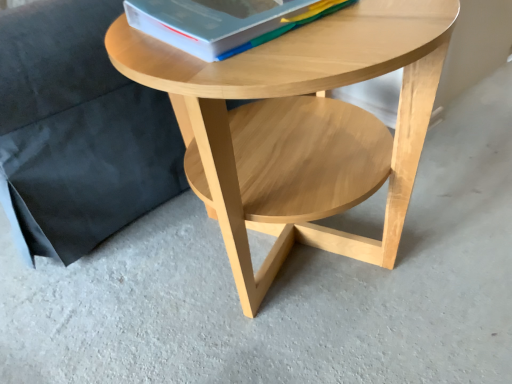
You are a GUI agent. You are given a task and a screenshot of the screen. Output one action in this format:
    pyautogui.click(x=<x>, y=<y>)
    Task: Click on the unoccupied area in front of hardcover book at upper center
    
    Given the screenshot: What is the action you would take?
    pyautogui.click(x=278, y=63)